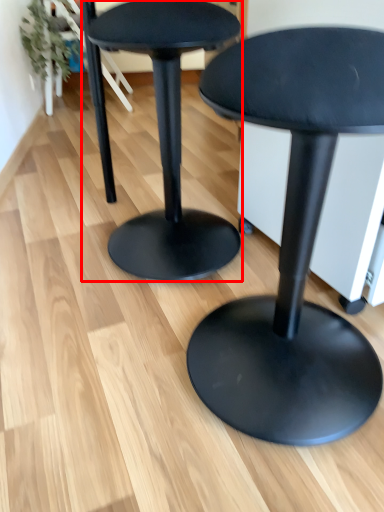
Question: From the image, what is the correct spatial relationship of stool (annotated by the red box) in relation to stool?

Choices:
 (A) left
 (B) right

Answer: (A)